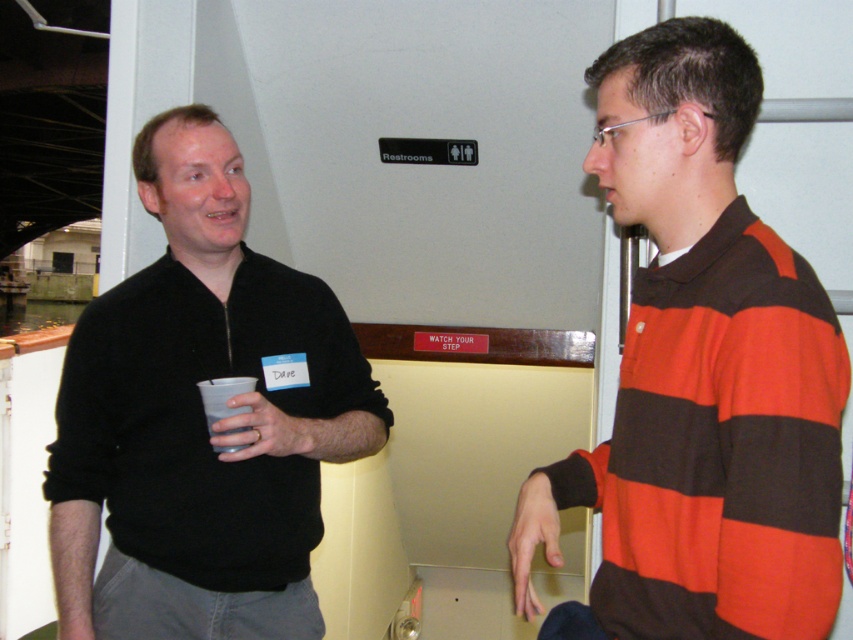
Question: Among these points, which one is farthest from the camera?

Choices:
 (A) (577, 605)
 (B) (140, 320)

Answer: (B)

Question: Can you confirm if striped cotton shirt at right is positioned above black matte sweater at center?

Choices:
 (A) no
 (B) yes

Answer: (B)

Question: Does striped cotton shirt at right lie behind black matte sweater at center?

Choices:
 (A) no
 (B) yes

Answer: (A)

Question: Which object appears farthest from the camera in this image?

Choices:
 (A) black matte sweater at center
 (B) striped cotton shirt at right

Answer: (A)

Question: Is striped cotton shirt at right wider than black matte sweater at center?

Choices:
 (A) yes
 (B) no

Answer: (B)

Question: Which point is closer to the camera taking this photo?

Choices:
 (A) (701, 33)
 (B) (154, 145)

Answer: (A)